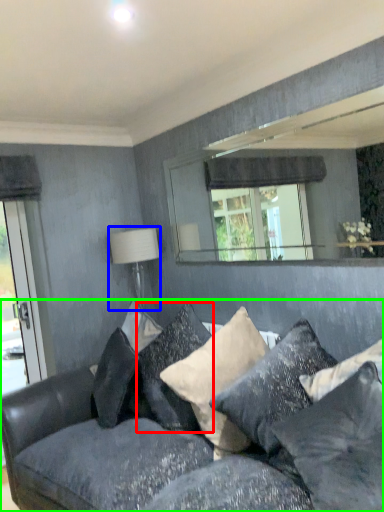
Question: Considering the real-world distances, which object is closest to pillow (highlighted by a red box)? table lamp (highlighted by a blue box) or studio couch (highlighted by a green box).

Choices:
 (A) table lamp
 (B) studio couch

Answer: (B)